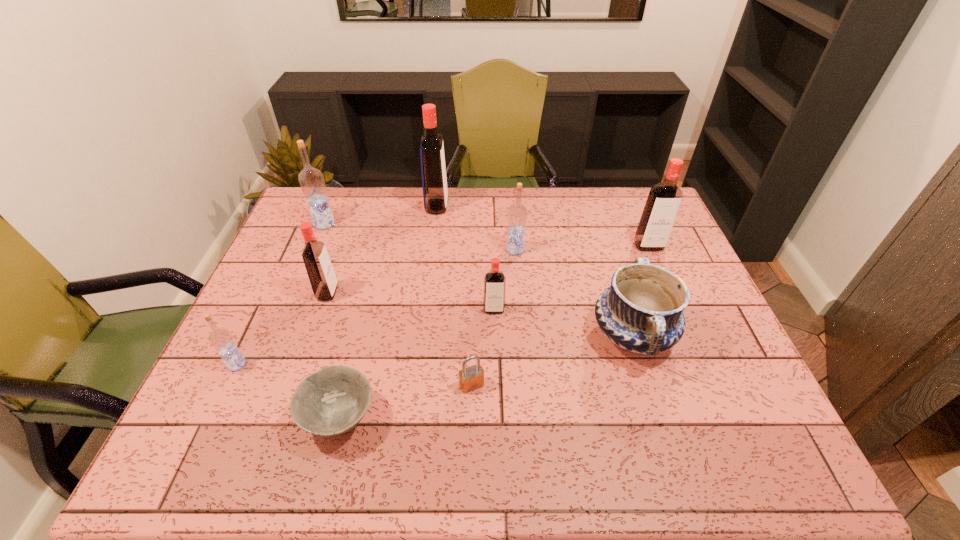
The image size is (960, 540). I want to click on red vodka that is the fourth closest to the second shortest object, so click(x=663, y=202).

Select which blue vodka is the closest to the third object from right to left. Please provide its 2D coordinates. Your answer should be formatted as a tuple, i.e. [(x, y)], where the tuple contains the x and y coordinates of a point satisfying the conditions above.

[(311, 180)]

Where is `blue vodka identified as the second closest to the sixth vodka from left to right`? blue vodka identified as the second closest to the sixth vodka from left to right is located at coordinates (221, 339).

You are a GUI agent. You are given a task and a screenshot of the screen. Output one action in this format:
    pyautogui.click(x=<x>, y=<y>)
    Task: Click on the free spot that satisfies the following two spatial constraints: 1. on the front and back of the third nearest red vodka; 2. on the front and back of the second nearest red vodka
    
    Given the screenshot: What is the action you would take?
    pyautogui.click(x=669, y=293)

Image resolution: width=960 pixels, height=540 pixels. I want to click on free space that satisfies the following two spatial constraints: 1. on the front and back of the third nearest vodka; 2. on the right side of the pottery, so click(313, 335).

Where is `blank space that satisfies the following two spatial constraints: 1. on the front side of the leftmost object; 2. on the left side of the ninth tallest object`? blank space that satisfies the following two spatial constraints: 1. on the front side of the leftmost object; 2. on the left side of the ninth tallest object is located at coordinates (227, 385).

The width and height of the screenshot is (960, 540). I want to click on vacant point that satisfies the following two spatial constraints: 1. on the front and back of the pottery; 2. on the right side of the tallest vodka, so click(x=421, y=335).